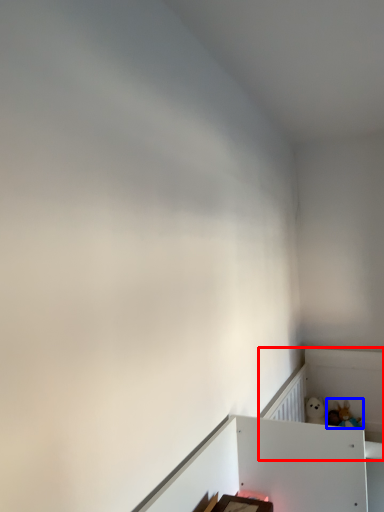
Question: Which object is closer to the camera taking this photo, bed frame (highlighted by a red box) or toy (highlighted by a blue box)?

Choices:
 (A) bed frame
 (B) toy

Answer: (A)